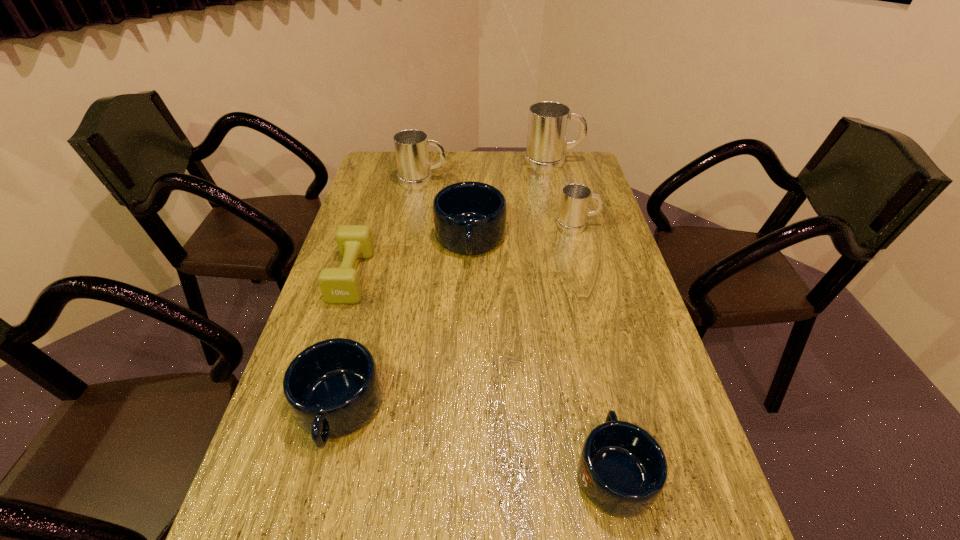
Where is `the rightmost blue mug`? This screenshot has height=540, width=960. the rightmost blue mug is located at coordinates (622, 469).

Locate an element on the screen. This screenshot has width=960, height=540. the shortest mug is located at coordinates (622, 469).

Locate an element on the screen. This screenshot has height=540, width=960. vacant region located 0.280m on the side of the fifth shortest mug with the handle is located at coordinates (522, 181).

I want to click on vacant space located 0.060m with the handle on the side of the biggest blue mug, so click(468, 282).

Identify the location of vacant region located 0.060m with the handle on the side of the leftmost blue mug. (317, 492).

Where is `vacant space located 0.070m on the back of the dumbbell`? The image size is (960, 540). vacant space located 0.070m on the back of the dumbbell is located at coordinates (364, 236).

What are the coordinates of `vacant point located with the handle on the side of the smallest blue mug` in the screenshot? It's located at (575, 294).

Where is `vacant space located 0.320m with the handle on the side of the smallest blue mug`? vacant space located 0.320m with the handle on the side of the smallest blue mug is located at coordinates (580, 314).

I want to click on vacant area situated 0.130m with the handle on the side of the smallest blue mug, so click(x=593, y=375).

The image size is (960, 540). Identify the location of dumbbell that is positioned at the left edge. (341, 285).